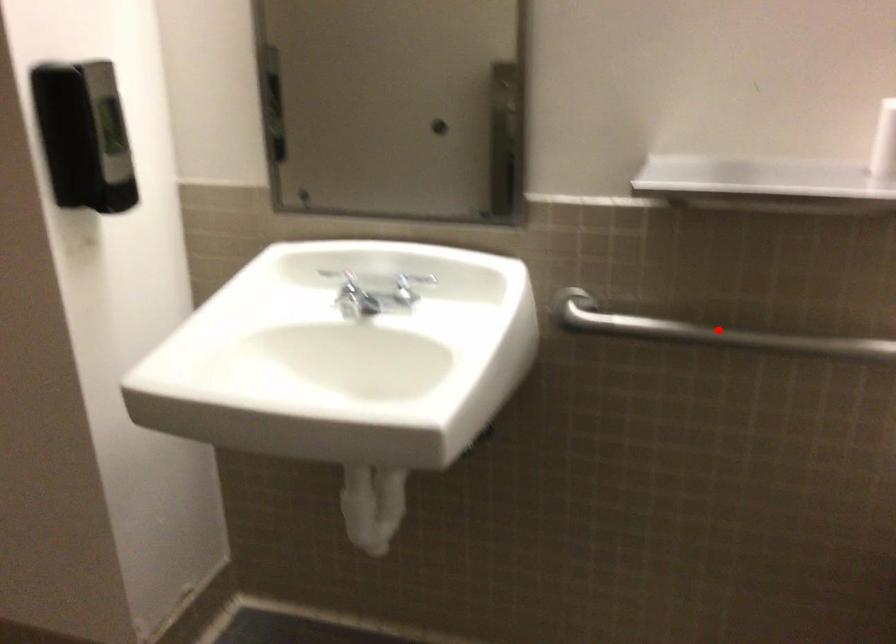
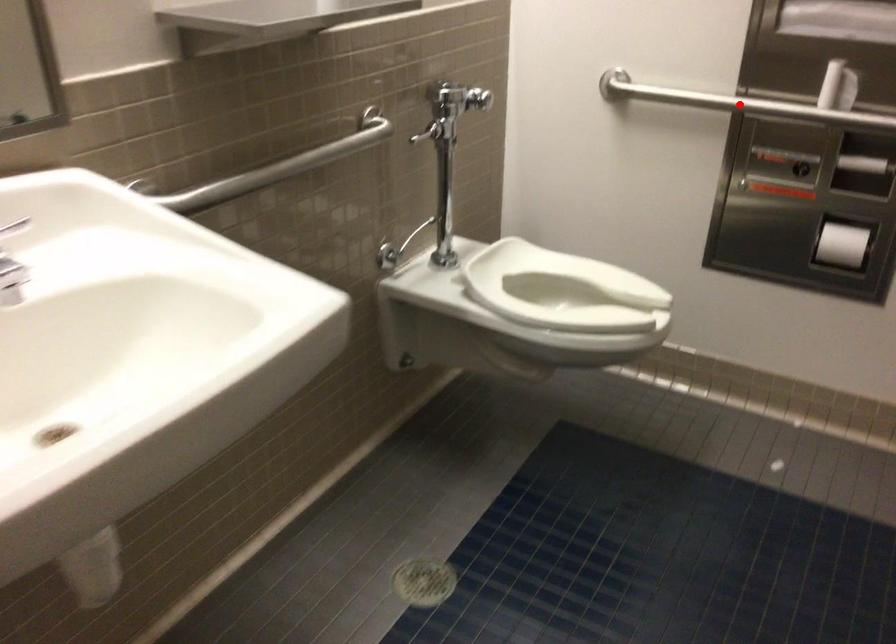
Based on the photo, I am providing you with two images of the same scene from different viewpoints. A red point is marked on the first image and another point is marked on the second image. Is the red point in image1 aligned with the point shown in image2?

No